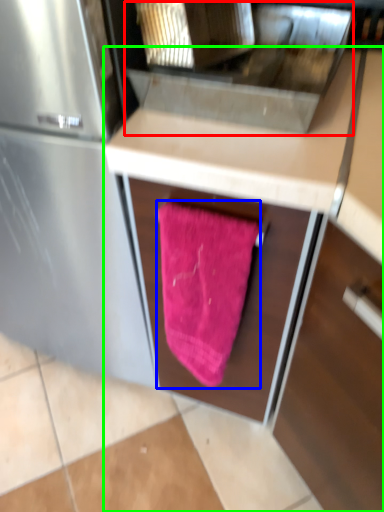
Question: Which object is the farthest from sink (highlighted by a red box)? Choose among these: beach towel (highlighted by a blue box) or cabinetry (highlighted by a green box).

Choices:
 (A) beach towel
 (B) cabinetry

Answer: (A)